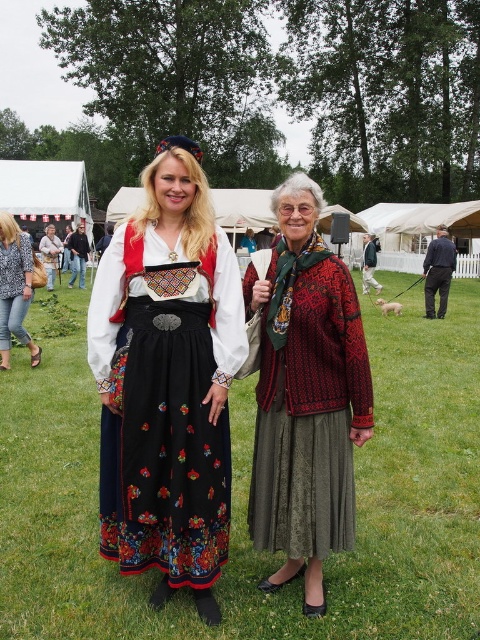
You are a photographer standing at the center of the field. You want to take a photo that includes both the denim jeans at lower left and the dark gray wool pants at right. Given that your camera has a 60 feet focal length lens, will both items be within the camera frame?

The denim jeans at lower left and dark gray wool pants at right are 27.79 feet apart from each other. Since the camera lens has a 60 feet focal length, which allows capturing a wider view, both items will be within the camera frame as their distance is less than the focal length.

You are standing in the grassy field where the two women are. You want to walk to the point at coordinates point (0, 312). How far will you have to walk?

The point (0, 312) is 7.16 meters from the viewer, so you will have to walk 7.16 meters to reach it.